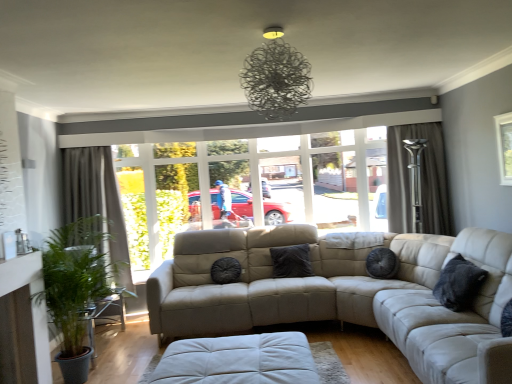
Where is `leather couch at right`? leather couch at right is located at coordinates (450, 310).

What is the approximate width of leather couch at right?

1.03 meters.

Describe the element at coordinates (97, 201) in the screenshot. Image resolution: width=512 pixels, height=384 pixels. I see `dark gray textured curtain at left, placed as the first curtain when sorted from left to right` at that location.

Image resolution: width=512 pixels, height=384 pixels. I want to click on matte beige couch at center, so click(x=408, y=179).

You are a GUI agent. You are given a task and a screenshot of the screen. Output one action in this format:
    pyautogui.click(x=<x>, y=<y>)
    Task: Click on the metallic wire chandelier at upper center
    This screenshot has width=512, height=384.
    Given the screenshot: What is the action you would take?
    pyautogui.click(x=276, y=77)

Locate an element on the screen. Image resolution: width=512 pixels, height=384 pixels. white leather footrest at lower center is located at coordinates (238, 360).

This screenshot has height=384, width=512. Describe the element at coordinates (226, 270) in the screenshot. I see `black textured pillow at center, the second pillow from the back` at that location.

You are a GUI agent. You are given a task and a screenshot of the screen. Output one action in this format:
    pyautogui.click(x=<x>, y=<y>)
    Task: Click on the leather couch at right
    The height and width of the screenshot is (384, 512).
    Given the screenshot: What is the action you would take?
    pyautogui.click(x=450, y=310)

Based on the photo, is green leafy plant at left behind white leather footrest at lower center?

Yes.

In the scene shown: Which is more to the left, green leafy plant at left or white leather footrest at lower center?

Positioned to the left is green leafy plant at left.

From the image's perspective, is green leafy plant at left above white leather footrest at lower center?

Indeed, from the image's perspective, green leafy plant at left is shown above white leather footrest at lower center.

From a real-world perspective, which object rests below the other?

white leather footrest at lower center.

From their relative heights in the image, would you say dark gray textured curtain at left, which is the 2th curtain in right-to-left order, is taller or shorter than velvet dark gray pillow at center, which is the first pillow from back to front?

In the image, dark gray textured curtain at left, which is the 2th curtain in right-to-left order, appears to be taller than velvet dark gray pillow at center, which is the first pillow from back to front.

Is dark gray textured curtain at left, which is the 2th curtain in right-to-left order, at the left side of velvet dark gray pillow at center, placed as the 2th pillow when sorted from right to left?

Yes, dark gray textured curtain at left, which is the 2th curtain in right-to-left order, is to the left of velvet dark gray pillow at center, placed as the 2th pillow when sorted from right to left.

Is dark gray textured curtain at left, which is the 2th curtain in right-to-left order, beside velvet dark gray pillow at center, placed as the 2th pillow when sorted from right to left?

dark gray textured curtain at left, which is the 2th curtain in right-to-left order, and velvet dark gray pillow at center, placed as the 2th pillow when sorted from right to left, are clearly separated.

Can velvet dark gray pillow at center, placed as the 2th pillow when sorted from right to left, be found inside dark gray textured curtain at left, placed as the first curtain when sorted from left to right?

No.

Based on the photo, from the image's perspective, which one is positioned higher, white leather footrest at lower center or dark gray textured curtain at left, placed as the first curtain when sorted from left to right?

dark gray textured curtain at left, placed as the first curtain when sorted from left to right.

Does white leather footrest at lower center have a lesser width compared to dark gray textured curtain at left, which is the 2th curtain in right-to-left order?

No.

From a real-world perspective, is white leather footrest at lower center above or below dark gray textured curtain at left, which is the 2th curtain in right-to-left order?

white leather footrest at lower center is below dark gray textured curtain at left, which is the 2th curtain in right-to-left order.

Looking at this image, which is further, (307, 357) or (119, 267)?

The point (119, 267) is behind.

In terms of height, does black textured pillow at center, the 3th pillow when ordered from right to left, look taller or shorter compared to green leafy plant at left?

Clearly, black textured pillow at center, the 3th pillow when ordered from right to left, is shorter compared to green leafy plant at left.

Looking at this image, does black textured pillow at center, placed as the second pillow when sorted from front to back, touch green leafy plant at left?

No, black textured pillow at center, placed as the second pillow when sorted from front to back, is not in contact with green leafy plant at left.

Which object is wider, black textured pillow at center, placed as the second pillow when sorted from front to back, or green leafy plant at left?

Wider between the two is green leafy plant at left.

From the image's perspective, would you say black textured pillow at center, the second pillow from the back, is shown under green leafy plant at left?

No, from the image's perspective, black textured pillow at center, the second pillow from the back, is not below green leafy plant at left.

Would you consider leather couch at right to be distant from black textured pillow at center, placed as the second pillow when sorted from front to back?

leather couch at right is far away from black textured pillow at center, placed as the second pillow when sorted from front to back.

Is leather couch at right surrounding black textured pillow at center, the second pillow from the back?

That's incorrect, black textured pillow at center, the second pillow from the back, is not inside leather couch at right.

Between leather couch at right and black textured pillow at center, placed as the second pillow when sorted from front to back, which one has smaller width?

With smaller width is black textured pillow at center, placed as the second pillow when sorted from front to back.

Can you confirm if leather couch at right is shorter than black textured pillow at center, acting as the 1th pillow starting from the left?

In fact, leather couch at right may be taller than black textured pillow at center, acting as the 1th pillow starting from the left.

From the image's perspective, is metallic wire chandelier at upper center located above or below matte beige couch at center?

Clearly, from the image's perspective, metallic wire chandelier at upper center is above matte beige couch at center.

Which is correct: metallic wire chandelier at upper center is inside matte beige couch at center, or outside of it?

metallic wire chandelier at upper center is outside matte beige couch at center.

Considering the positions of point (254, 65) and point (433, 133), is point (254, 65) closer or farther from the camera than point (433, 133)?

Point (254, 65) is closer to the camera than point (433, 133).

Would you say metallic wire chandelier at upper center is to the left or to the right of matte beige couch at center in the picture?

metallic wire chandelier at upper center is positioned on matte beige couch at center's right side.

From the picture: From the image's perspective, is white leather footrest at lower center located above or below matte beige couch at center?

white leather footrest at lower center is below matte beige couch at center.

Where is `bay window that appears above the white leather footrest at lower center (from the image's perspective)`? This screenshot has width=512, height=384. bay window that appears above the white leather footrest at lower center (from the image's perspective) is located at coordinates (408, 179).

Is white leather footrest at lower center not inside matte beige couch at center?

Yes.

From a real-world perspective, is white leather footrest at lower center physically below matte beige couch at center?

Correct, in the physical world, white leather footrest at lower center is lower than matte beige couch at center.

In order to click on footrest lying on the right of green leafy plant at left in this screenshot , I will do `click(238, 360)`.

There is a dark gray textured curtain at left, placed as the first curtain when sorted from left to right. Identify the location of the 2nd pillow below it (from a real-world perspective). (291, 261).

Estimate the real-world distances between objects in this image. Which object is closer to green leafy plant at left, metallic wire chandelier at upper center or velvet dark gray pillow at center, placed as the 2th pillow when sorted from right to left?

velvet dark gray pillow at center, placed as the 2th pillow when sorted from right to left, is closer to green leafy plant at left.

From the picture: Estimate the real-world distances between objects in this image. Which object is closer to dark gray textured curtain at left, placed as the first curtain when sorted from left to right, velvet dark gray pillow at center, which is the first pillow from back to front, or dark gray fabric curtain at right, the 2th curtain when ordered from left to right?

The object closer to dark gray textured curtain at left, placed as the first curtain when sorted from left to right, is velvet dark gray pillow at center, which is the first pillow from back to front.

Which object lies nearer to the anchor point green leafy plant at left, dark gray textured pillow at right, the third pillow when ordered from back to front, or white leather footrest at lower center?

Among the two, white leather footrest at lower center is located nearer to green leafy plant at left.

Considering their positions, is dark gray textured curtain at left, placed as the first curtain when sorted from left to right, positioned closer to black textured pillow at center, placed as the second pillow when sorted from front to back, than dark gray fabric curtain at right, which is the first curtain from right to left?

dark gray textured curtain at left, placed as the first curtain when sorted from left to right.

Estimate the real-world distances between objects in this image. Which object is closer to leather couch at right, metallic wire chandelier at upper center or dark gray textured pillow at right, acting as the 3th pillow starting from the left?

Among the two, dark gray textured pillow at right, acting as the 3th pillow starting from the left, is located nearer to leather couch at right.

Estimate the real-world distances between objects in this image. Which object is further from velvet dark gray pillow at center, positioned as the third pillow in front-to-back order, leather couch at right or metallic wire chandelier at upper center?

The object further to velvet dark gray pillow at center, positioned as the third pillow in front-to-back order, is metallic wire chandelier at upper center.

When comparing their distances from dark gray textured pillow at right, the 1th pillow positioned from the right, does green leafy plant at left or matte beige couch at center seem further?

green leafy plant at left is positioned further to the anchor dark gray textured pillow at right, the 1th pillow positioned from the right.

Considering their positions, is black textured pillow at center, the 3th pillow when ordered from right to left, positioned closer to green leafy plant at left than velvet dark gray pillow at center, positioned as the third pillow in front-to-back order?

black textured pillow at center, the 3th pillow when ordered from right to left, is positioned closer to the anchor green leafy plant at left.

I want to click on light fixture situated between dark gray textured curtain at left, which is the 2th curtain in right-to-left order, and dark gray fabric curtain at right, the 2th curtain when ordered from left to right, from left to right, so click(x=276, y=77).

At what (x,y) coordinates should I click in order to perform the action: click on the footrest located between leather couch at right and black textured pillow at center, the 3th pillow when ordered from right to left, in the depth direction. Please return your answer as a coordinate pair (x, y). This screenshot has height=384, width=512. Looking at the image, I should click on (238, 360).

Find the location of `light fixture between dark gray textured curtain at left, which is the 2th curtain in right-to-left order, and leather couch at right, in the horizontal direction`. light fixture between dark gray textured curtain at left, which is the 2th curtain in right-to-left order, and leather couch at right, in the horizontal direction is located at coordinates (276, 77).

Where is `light fixture positioned between leather couch at right and dark gray fabric curtain at right, the 2th curtain when ordered from left to right, from near to far`? light fixture positioned between leather couch at right and dark gray fabric curtain at right, the 2th curtain when ordered from left to right, from near to far is located at coordinates point(276,77).